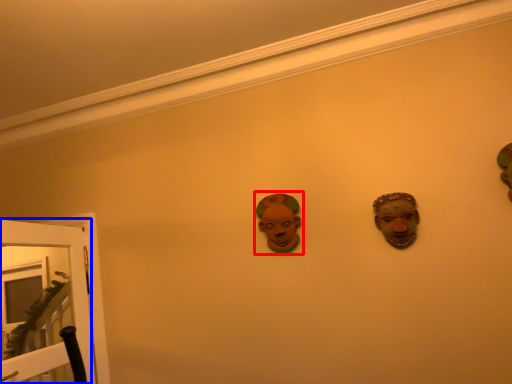
Question: Which point is further to the camera, person (highlighted by a red box) or door (highlighted by a blue box)?

Choices:
 (A) person
 (B) door

Answer: (A)